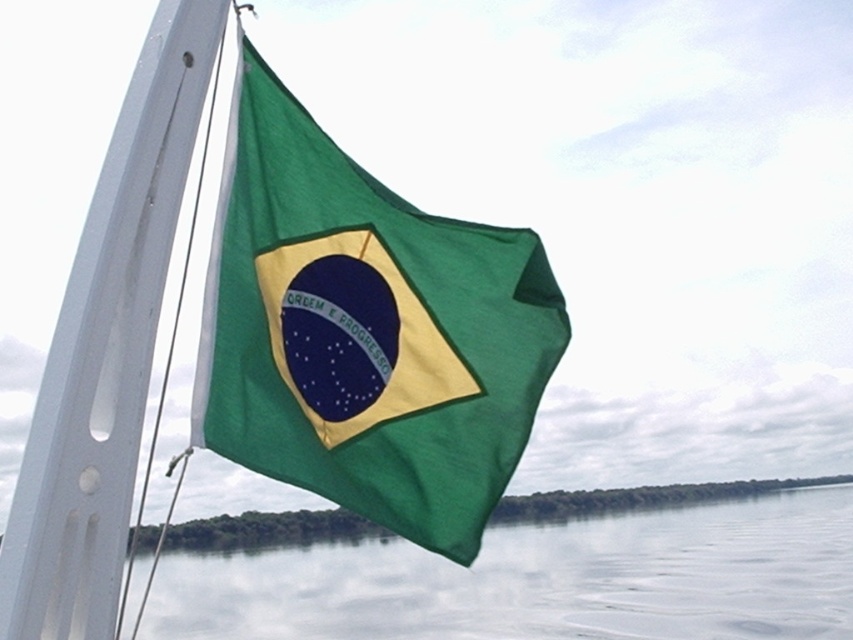
Question: Considering the real-world distances, which object is closest to the white matte flag pole at left?

Choices:
 (A) green fabric flag at center
 (B) transparent water at lower center

Answer: (A)

Question: Is transparent water at lower center above white matte flag pole at left?

Choices:
 (A) yes
 (B) no

Answer: (B)

Question: Which point is closer to the camera taking this photo?

Choices:
 (A) (115, 385)
 (B) (230, 145)

Answer: (A)

Question: Is transparent water at lower center positioned behind white matte flag pole at left?

Choices:
 (A) yes
 (B) no

Answer: (A)

Question: Does green fabric flag at center appear on the left side of transparent water at lower center?

Choices:
 (A) yes
 (B) no

Answer: (A)

Question: Which point is farther to the camera?

Choices:
 (A) green fabric flag at center
 (B) transparent water at lower center

Answer: (A)